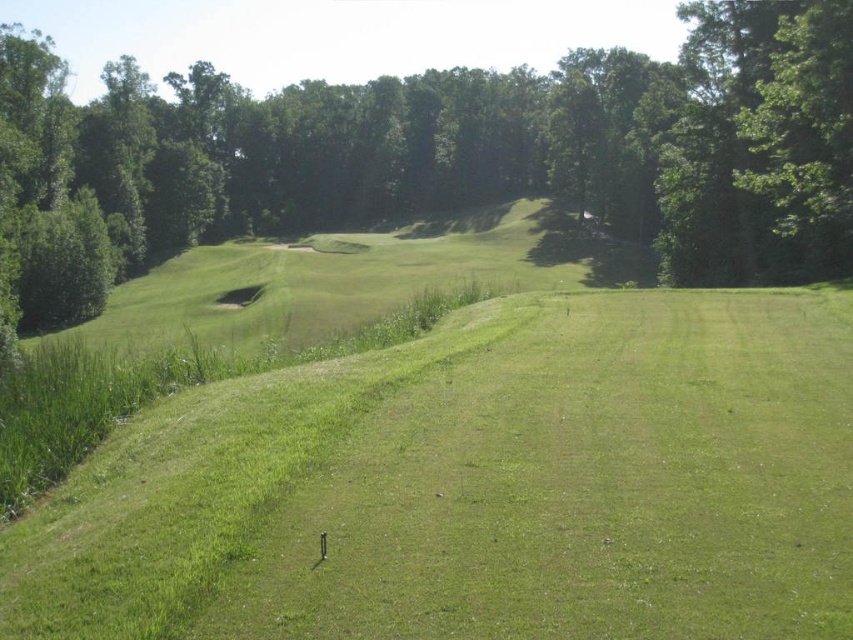
Question: Among these points, which one is nearest to the camera?

Choices:
 (A) (695, 20)
 (B) (233, 410)

Answer: (B)

Question: Among these objects, which one is nearest to the camera?

Choices:
 (A) green grassy field at center
 (B) green leafy tree at center

Answer: (A)

Question: Does green grassy field at center have a lesser width compared to green leafy tree at center?

Choices:
 (A) yes
 (B) no

Answer: (A)

Question: Does green grassy field at center have a lesser width compared to green leafy tree at center?

Choices:
 (A) yes
 (B) no

Answer: (A)

Question: Is green grassy field at center positioned behind green leafy tree at center?

Choices:
 (A) yes
 (B) no

Answer: (B)